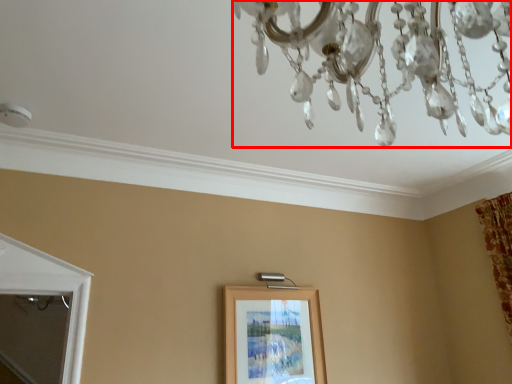
Question: From the image's perspective, where is chandelier (annotated by the red box) located relative to picture frame?

Choices:
 (A) below
 (B) above

Answer: (B)